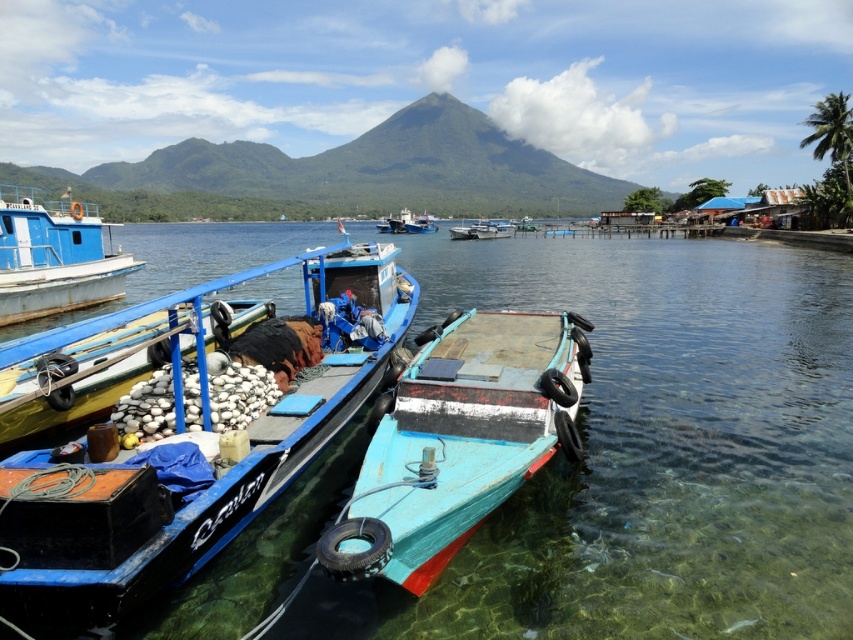
You are standing on the dock and want to board the rusty wooden boat at center and the blue painted wooden boat at center. Which boat should you approach first to reach the one farther away last?

You should approach the rusty wooden boat at center first because it is closer to you, and then the blue painted wooden boat at center which is farther away.

You are standing at the point with coordinates (459, 440) in the coastal scene. What object are you directly positioned on?

You are directly positioned on the rusty wooden boat at center.

You are standing at the origin point of the coordinate system in the image. You want to move towards the rusty wooden boat at center. What direction should you move in?

Since the rusty wooden boat at center is located at coordinate point (459, 440), you should move towards the positive x and y directions to reach it.